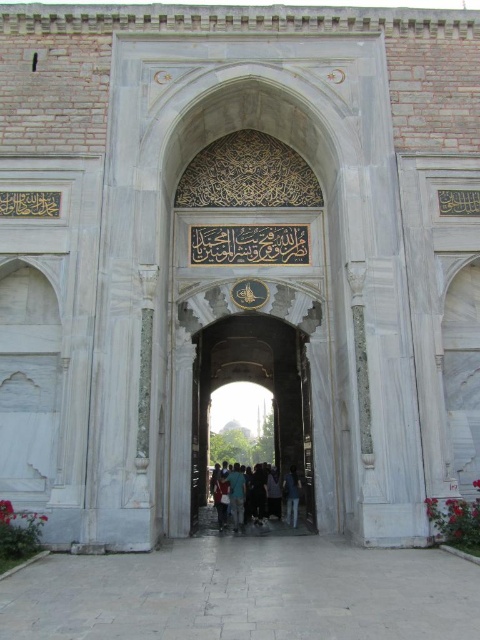
Question: Which object appears closest to the camera in this image?

Choices:
 (A) white marble archway at center
 (B) light blue jeans at center

Answer: (A)

Question: Which object is positioned closest to the dark blue jeans at center?

Choices:
 (A) light blue jeans at center
 (B) white marble archway at center

Answer: (A)

Question: Is white marble archway at center to the left of dark blue jeans at center from the viewer's perspective?

Choices:
 (A) yes
 (B) no

Answer: (A)

Question: Among these objects, which one is nearest to the camera?

Choices:
 (A) white marble archway at center
 (B) light blue jeans at center
 (C) dark blue jeans at center

Answer: (A)

Question: Where is white marble archway at center located in relation to dark blue jeans at center in the image?

Choices:
 (A) below
 (B) above

Answer: (B)

Question: Can you confirm if dark blue jeans at center is positioned to the right of light blue jeans at center?

Choices:
 (A) no
 (B) yes

Answer: (A)